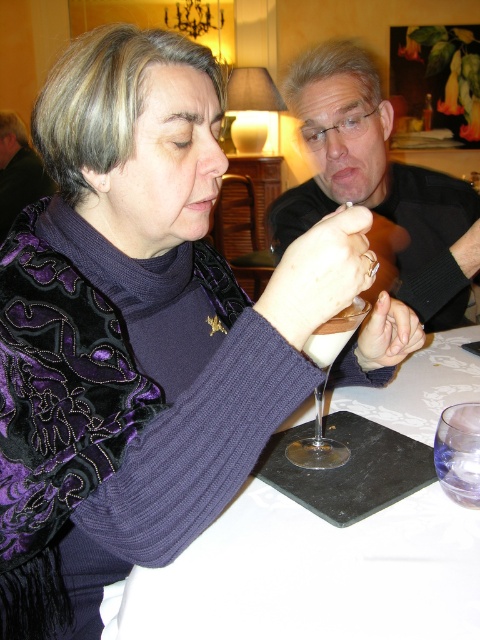
The height and width of the screenshot is (640, 480). What are the coordinates of `transparent glass at center` in the screenshot? It's located at (324, 387).

Image resolution: width=480 pixels, height=640 pixels. What do you see at coordinates (324, 387) in the screenshot? I see `transparent glass at center` at bounding box center [324, 387].

The width and height of the screenshot is (480, 640). Identify the location of transparent glass at center. (324, 387).

Between white matte table at center and transparent glass at lower right, which one is positioned lower?

white matte table at center

Who is taller, white matte table at center or transparent glass at lower right?

Standing taller between the two is white matte table at center.

What do you see at coordinates (314, 576) in the screenshot?
I see `white matte table at center` at bounding box center [314, 576].

The image size is (480, 640). I want to click on white matte table at center, so click(x=314, y=576).

The width and height of the screenshot is (480, 640). What do you see at coordinates (376, 180) in the screenshot?
I see `matte black shirt at upper right` at bounding box center [376, 180].

Can you confirm if matte black shirt at upper right is positioned above transparent glass at center?

Indeed, matte black shirt at upper right is positioned over transparent glass at center.

You are a GUI agent. You are given a task and a screenshot of the screen. Output one action in this format:
    pyautogui.click(x=<x>, y=<y>)
    Task: Click on the matte black shirt at upper right
    
    Given the screenshot: What is the action you would take?
    pyautogui.click(x=376, y=180)